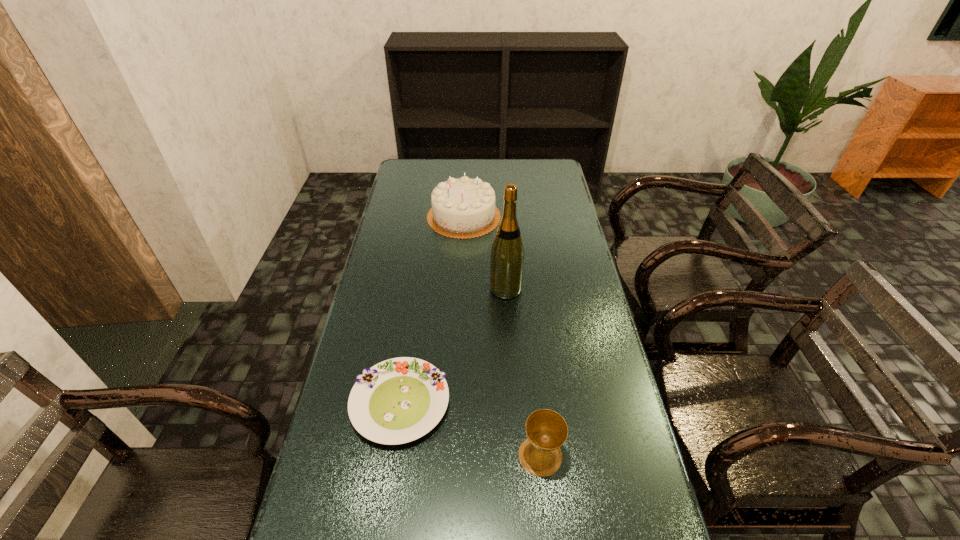
At what (x,y) coordinates should I click in order to perform the action: click on free space between the farthest object and the shortest object. Please return your answer as a coordinate pair (x, y). The width and height of the screenshot is (960, 540). Looking at the image, I should click on (432, 310).

This screenshot has height=540, width=960. In order to click on unoccupied area between the farthest object and the salad plate in this screenshot , I will do `click(432, 310)`.

I want to click on blank region between the tallest object and the second tallest object, so click(485, 253).

What are the coordinates of `free space between the chalice and the farthest object` in the screenshot? It's located at [502, 336].

Identify the location of vacant region between the farthest object and the chalice. The image size is (960, 540). point(502,336).

This screenshot has width=960, height=540. What are the coordinates of `empty location between the tallest object and the shortest object` in the screenshot? It's located at coord(453,346).

The height and width of the screenshot is (540, 960). I want to click on free spot between the tallest object and the third tallest object, so click(523, 372).

Locate an element on the screen. This screenshot has width=960, height=540. vacant point located between the salad plate and the chalice is located at coordinates (470, 429).

The height and width of the screenshot is (540, 960). I want to click on the second closest object to the third nearest object, so click(x=399, y=400).

Identify the location of the closest object relative to the farthest object. This screenshot has width=960, height=540. (507, 253).